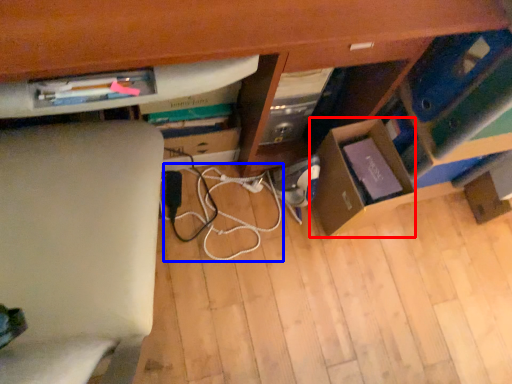
Question: Which object appears closest to the camera in this image, cardboard box (highlighted by a red box) or string (highlighted by a blue box)?

Choices:
 (A) cardboard box
 (B) string

Answer: (A)